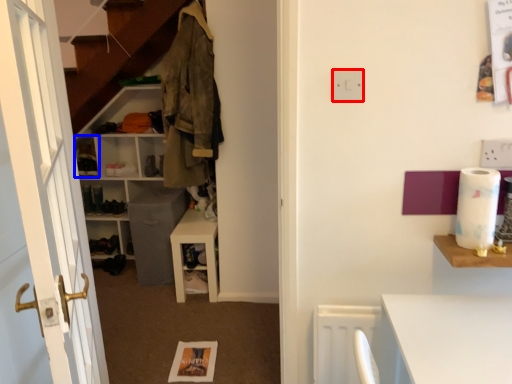
Question: Which of the following is the closest to the observer, electric outlet (highlighted by a red box) or cabinet (highlighted by a blue box)?

Choices:
 (A) electric outlet
 (B) cabinet

Answer: (A)